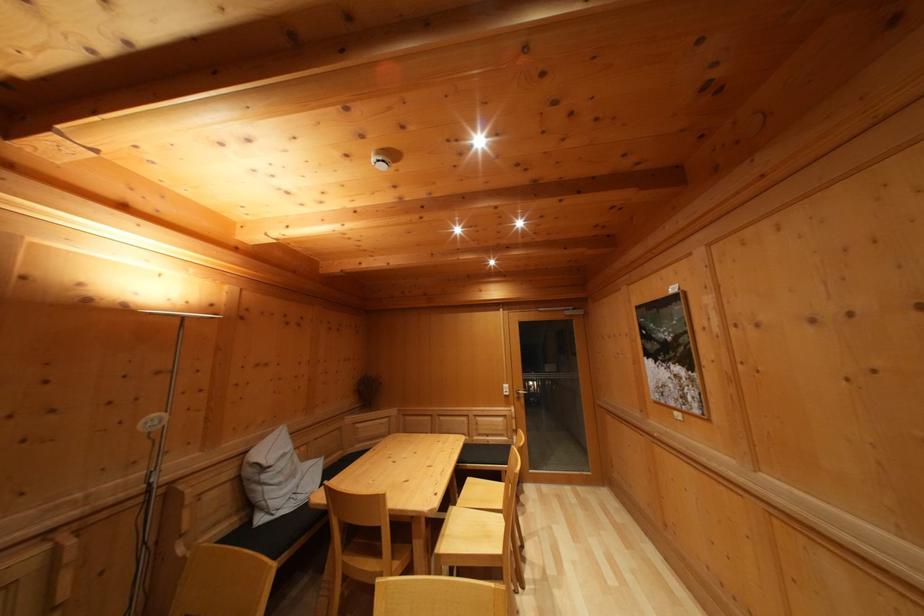
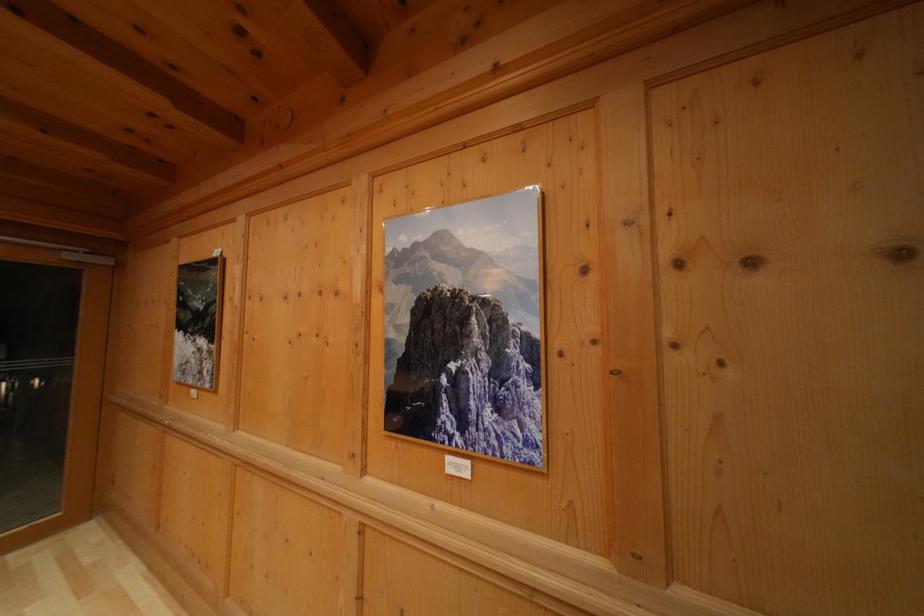
Locate, in the second image, the point that corresponds to [684,314] in the first image.

(222, 281)